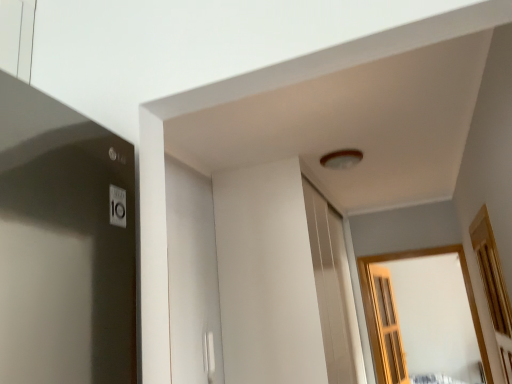
Question: Is wooden-framed window at center, which is the 1th window in back-to-front order, shorter than wooden at right, the second window from the back?

Choices:
 (A) no
 (B) yes

Answer: (A)

Question: Does wooden-framed window at center, the 2th window positioned from the front, lie in front of wooden at right, the second window from the back?

Choices:
 (A) no
 (B) yes

Answer: (A)

Question: Is wooden-framed window at center, the 2th window positioned from the front, taller than wooden at right, placed as the first window when sorted from front to back?

Choices:
 (A) no
 (B) yes

Answer: (B)

Question: Is wooden-framed window at center, which is the 1th window in back-to-front order, further to camera compared to wooden at right, the second window from the back?

Choices:
 (A) no
 (B) yes

Answer: (B)

Question: From the image's perspective, is wooden-framed window at center, which is the 1th window in back-to-front order, under wooden at right, placed as the first window when sorted from front to back?

Choices:
 (A) no
 (B) yes

Answer: (B)

Question: From their relative heights in the image, would you say wooden at right, placed as the first window when sorted from front to back, is taller or shorter than wooden-framed window at center, which is the 1th window in back-to-front order?

Choices:
 (A) tall
 (B) short

Answer: (B)

Question: From the image's perspective, is wooden at right, placed as the first window when sorted from front to back, located above or below wooden-framed window at center, which is the 1th window in back-to-front order?

Choices:
 (A) below
 (B) above

Answer: (B)

Question: Which is correct: wooden at right, the second window from the back, is inside wooden-framed window at center, which is the 1th window in back-to-front order, or outside of it?

Choices:
 (A) outside
 (B) inside

Answer: (A)

Question: From a real-world perspective, is wooden at right, placed as the first window when sorted from front to back, positioned above or below wooden-framed window at center, the 2th window positioned from the front?

Choices:
 (A) above
 (B) below

Answer: (A)

Question: Is wooden-framed window at center, the 2th window positioned from the front, bigger or smaller than wooden at right, placed as the first window when sorted from front to back?

Choices:
 (A) big
 (B) small

Answer: (A)

Question: From a real-world perspective, is wooden-framed window at center, which is the 1th window in back-to-front order, positioned above or below wooden at right, placed as the first window when sorted from front to back?

Choices:
 (A) below
 (B) above

Answer: (A)

Question: From their relative heights in the image, would you say wooden-framed window at center, which is the 1th window in back-to-front order, is taller or shorter than wooden at right, placed as the first window when sorted from front to back?

Choices:
 (A) short
 (B) tall

Answer: (B)

Question: Is wooden-framed window at center, the 2th window positioned from the front, wider or thinner than wooden at right, placed as the first window when sorted from front to back?

Choices:
 (A) wide
 (B) thin

Answer: (A)

Question: Choose the correct answer: Is wooden screen door at right inside wooden at right, the second window from the back, or outside it?

Choices:
 (A) inside
 (B) outside

Answer: (B)

Question: From the image's perspective, is wooden screen door at right positioned above or below wooden at right, placed as the first window when sorted from front to back?

Choices:
 (A) below
 (B) above

Answer: (A)